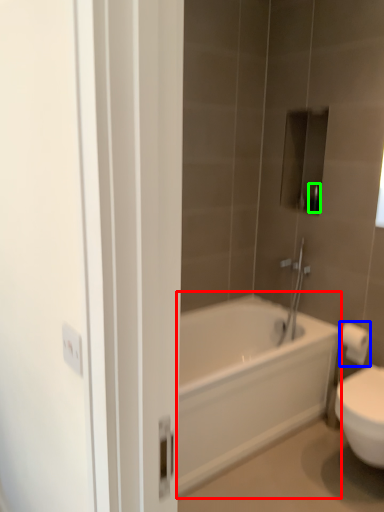
Question: Which object is positioned closest to bathtub (highlighted by a red box)? Select from toilet paper (highlighted by a blue box) and toiletry (highlighted by a green box).

Choices:
 (A) toilet paper
 (B) toiletry

Answer: (A)